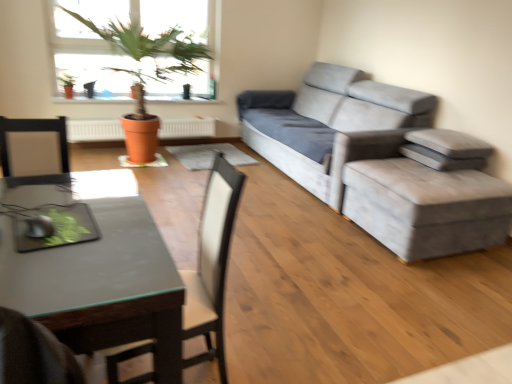
Identify the location of space that is in front of velvet grey couch at right. (321, 244).